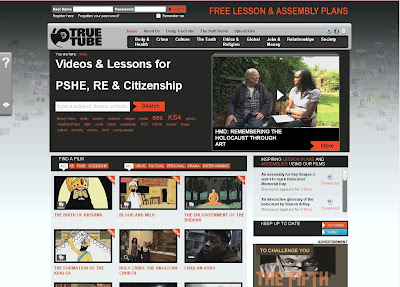
Identify the location of open book in lap. The width and height of the screenshot is (400, 287). (282, 118).